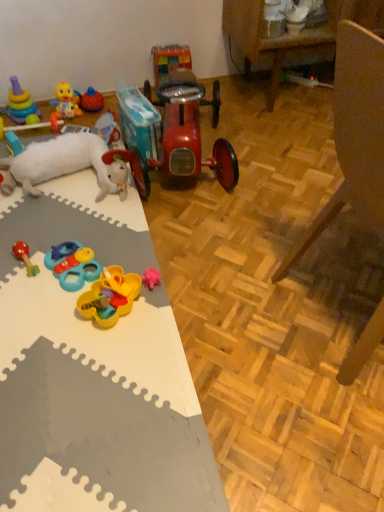
Locate an element on the screen. This screenshot has width=384, height=512. vacant area that lies between rubberized red and green rattle at lower left, which ranks as the eighth toy in right-to-left order, and white plush sheep at left, which ranks as the 7th toy in right-to-left order is located at coordinates (59, 221).